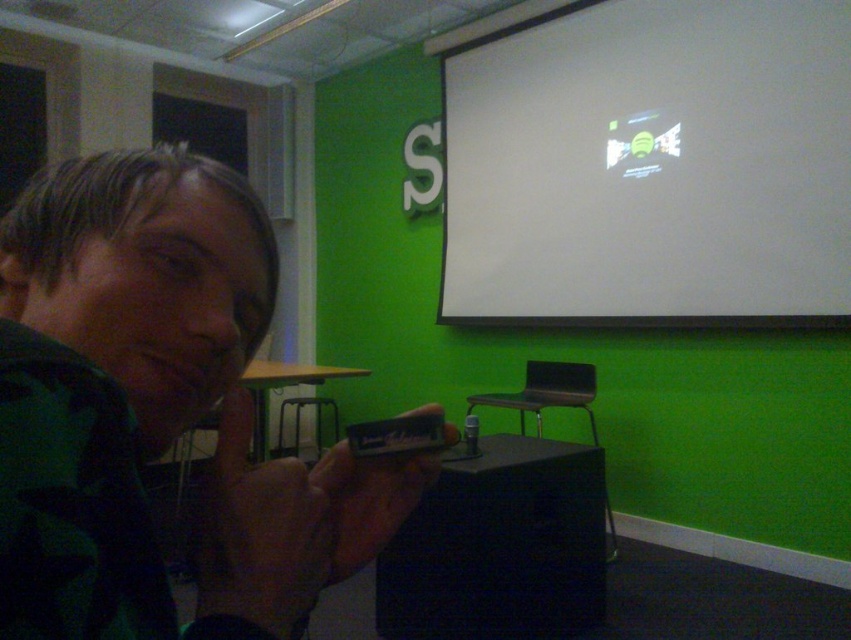
Is green camouflage shirt at left below white matte projection screen at upper center?

Yes.

Which is behind, point (77, 252) or point (638, 10)?

Positioned behind is point (638, 10).

Is point (363, 477) closer to viewer compared to point (578, 97)?

That is True.

This screenshot has width=851, height=640. I want to click on green camouflage shirt at left, so click(156, 412).